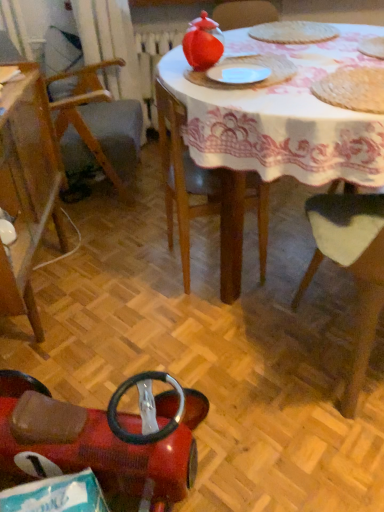
I want to click on free space that is in between woven mat at upper right, which is the 1th food from front to back, and matte glass tea pot at upper center, so click(x=295, y=82).